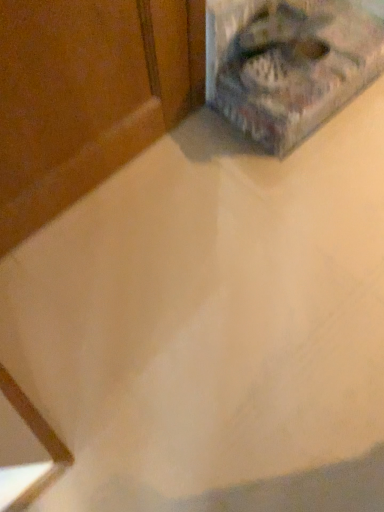
What do you see at coordinates (288, 64) in the screenshot? I see `textured paper bag at upper right` at bounding box center [288, 64].

Where is `textured paper bag at upper right`? The height and width of the screenshot is (512, 384). textured paper bag at upper right is located at coordinates 288,64.

You are a GUI agent. You are given a task and a screenshot of the screen. Output one action in this format:
    pyautogui.click(x=<x>, y=<y>)
    Task: Click on the textured paper bag at upper right
    This screenshot has height=512, width=384.
    Given the screenshot: What is the action you would take?
    pyautogui.click(x=288, y=64)